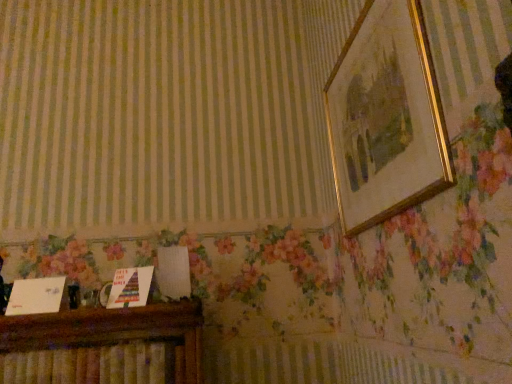
Question: From their relative heights in the image, would you say wooden cabinet at lower left is taller or shorter than gold/golden picture frame at upper right?

Choices:
 (A) short
 (B) tall

Answer: (A)

Question: In terms of size, does wooden cabinet at lower left appear bigger or smaller than gold/golden picture frame at upper right?

Choices:
 (A) small
 (B) big

Answer: (A)

Question: Considering the positions of point (100, 311) and point (393, 148), is point (100, 311) closer or farther from the camera than point (393, 148)?

Choices:
 (A) closer
 (B) farther

Answer: (B)

Question: Is gold/golden picture frame at upper right situated inside wooden cabinet at lower left or outside?

Choices:
 (A) outside
 (B) inside

Answer: (A)

Question: Considering the positions of point (431, 96) and point (146, 304), is point (431, 96) closer or farther from the camera than point (146, 304)?

Choices:
 (A) closer
 (B) farther

Answer: (A)

Question: Looking at the image, does gold/golden picture frame at upper right seem bigger or smaller compared to wooden cabinet at lower left?

Choices:
 (A) big
 (B) small

Answer: (A)

Question: In terms of width, does gold/golden picture frame at upper right look wider or thinner when compared to wooden cabinet at lower left?

Choices:
 (A) thin
 (B) wide

Answer: (A)